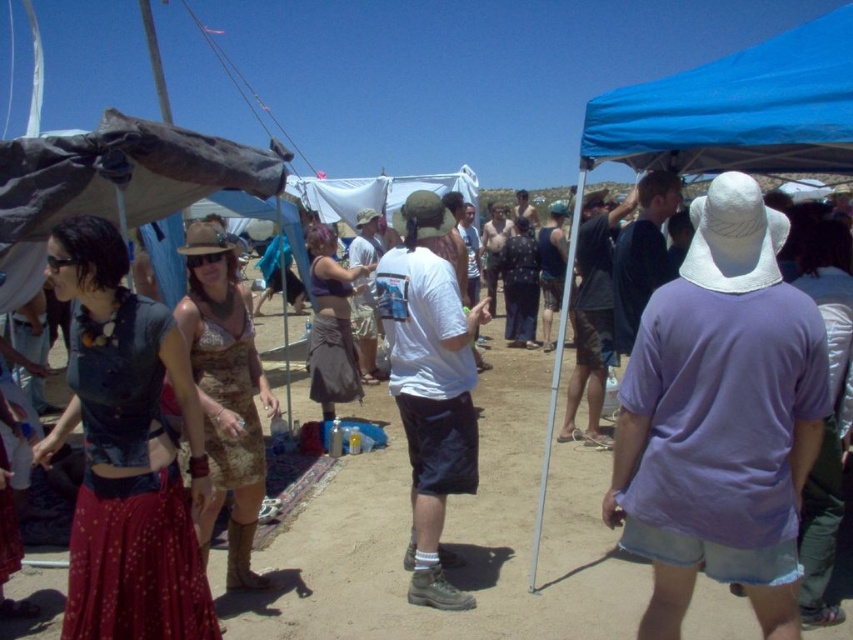
Can you confirm if purple cotton shirt at center is positioned below blue fabric canopy at upper right?

Yes.

Between point (753, 241) and point (820, 74), which one is positioned behind?

Positioned behind is point (820, 74).

Is point (735, 552) more distant than point (833, 145)?

That is False.

The height and width of the screenshot is (640, 853). What are the coordinates of `purple cotton shirt at center` in the screenshot? It's located at (721, 417).

Can you confirm if purple cotton shirt at center is taller than matte black top at center?

Yes, purple cotton shirt at center is taller than matte black top at center.

Is point (680, 566) positioned in front of point (103, 273)?

No, it is behind (103, 273).

Is point (734, 380) behind point (173, 365)?

That is False.

You are a GUI agent. You are given a task and a screenshot of the screen. Output one action in this format:
    pyautogui.click(x=<x>, y=<y>)
    Task: Click on the purple cotton shirt at center
    This screenshot has height=640, width=853.
    Given the screenshot: What is the action you would take?
    pyautogui.click(x=721, y=417)

Is point (802, 44) positioned before point (454, 404)?

No, it is not.

The height and width of the screenshot is (640, 853). What do you see at coordinates (738, 109) in the screenshot?
I see `blue fabric canopy at upper right` at bounding box center [738, 109].

Locate an element on the screen. blue fabric canopy at upper right is located at coordinates (738, 109).